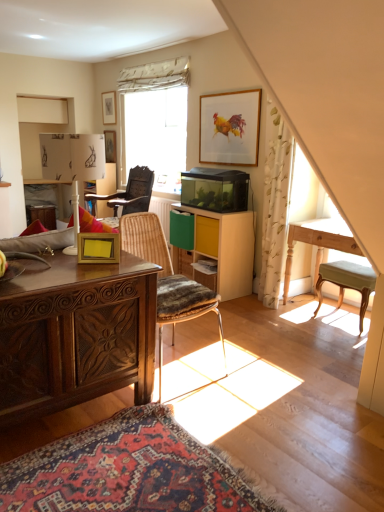
Locate an element on the screen. vacant space situated on the left part of light wood table at right is located at coordinates (273, 320).